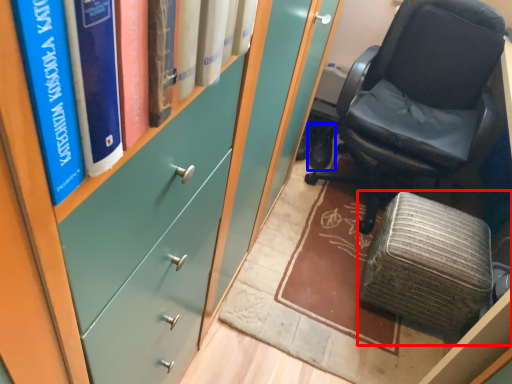
Question: Which object appears closest to the camera in this image, furniture (highlighted by a red box) or footwear (highlighted by a blue box)?

Choices:
 (A) furniture
 (B) footwear

Answer: (A)